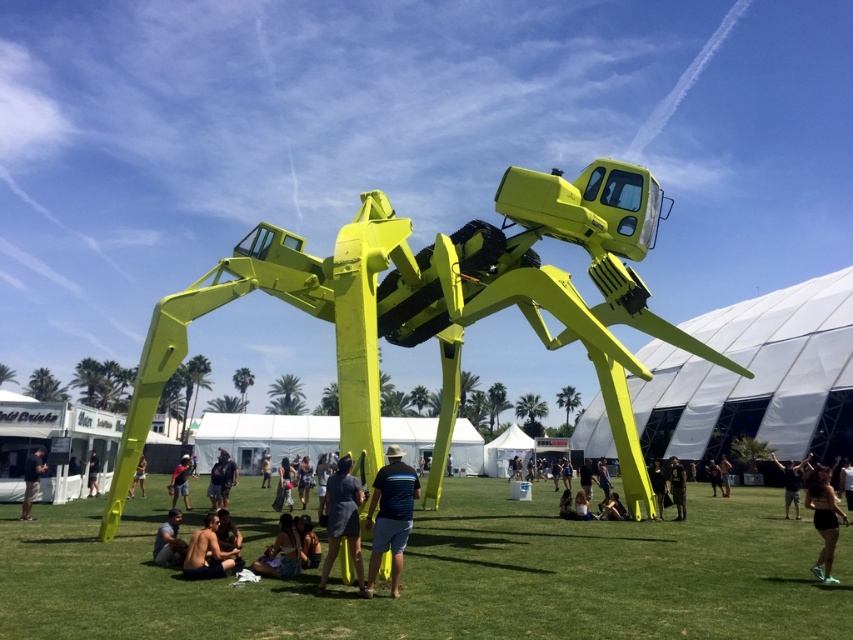
You are a photographer trying to capture a photo of the lime green spider sculpture. You notice two people in the foreground wearing black matte shorts at lower right and skinny jeans at lower center. Since you want to focus on the sculpture, which clothing item is narrower and less likely to distract from the main subject?

The black matte shorts at lower right has a lesser width compared to the skinny jeans at lower center, so it is narrower and less likely to distract from the main subject.

You are standing in the grassy field looking at the lime green spider sculpture. There are two points marked on the sculpture. The first point is at coordinate point (840, 512) and the second is at point (131, 490). If you want to touch the closest point to you on the sculpture, which coordinate should you aim for?

The point at coordinate point (840, 512) is closer to the viewer, so you should aim for point (840, 512).

You are standing in front of the lime green spider sculpture and want to take a photo. There are two points marked on the sculpture. One is at coordinate point (509, 584) and the other is at point (42, 452). Which point is closer to you?

Point (509, 584) is closer to the camera than point (42, 452), so the point at (509, 584) is closer to you.